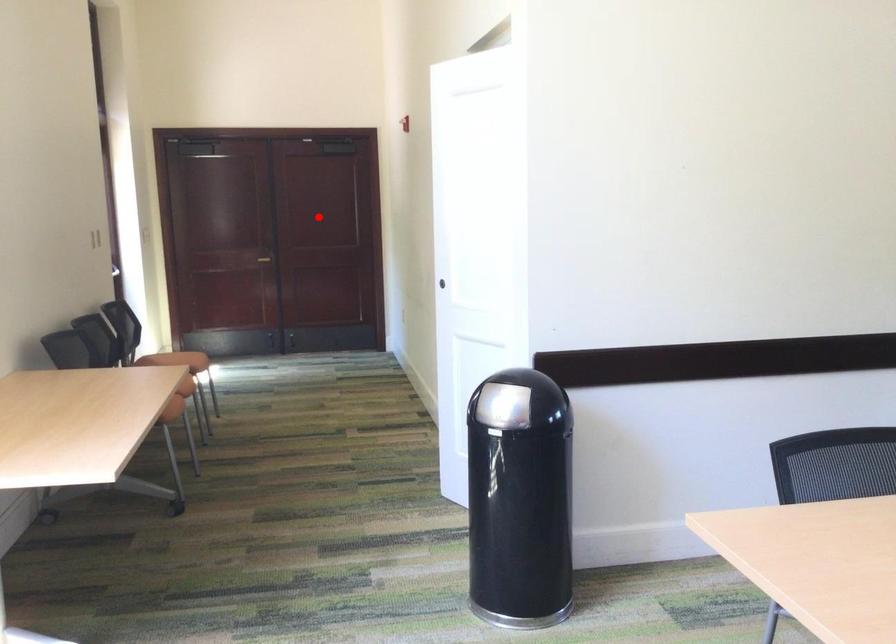
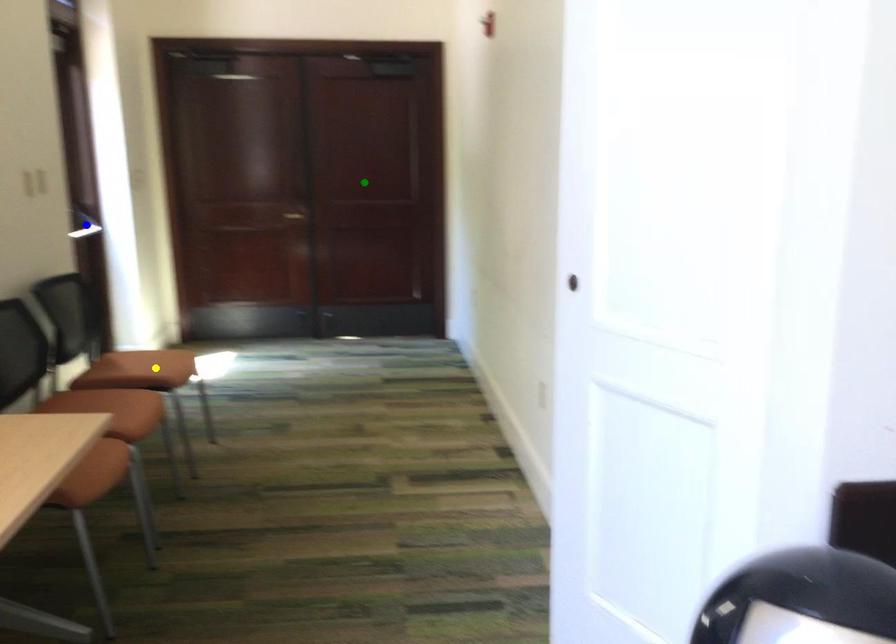
Question: I am providing you with two images of the same scene from different viewpoints. A red point is marked on the first image. You are given multiple points on the second image. In image 2, which mark is for the same physical point as the one in image 1?

Choices:
 (A) green point
 (B) yellow point
 (C) blue point

Answer: (A)